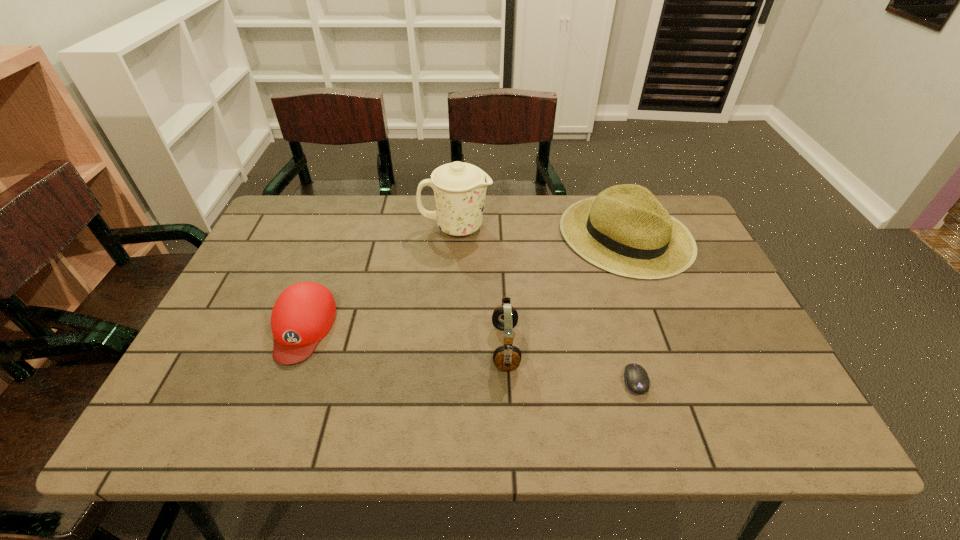
The image size is (960, 540). Identify the location of vacant area in the image that satisfies the following two spatial constraints: 1. on the front-facing side of the baseball cap; 2. on the right side of the shortest object. (283, 381).

This screenshot has width=960, height=540. I want to click on free location that satisfies the following two spatial constraints: 1. on the spout of the chinaware; 2. on the left side of the sunhat, so click(x=455, y=235).

Where is `vacant space that satisfies the following two spatial constraints: 1. on the spout of the chinaware; 2. on the front-facing side of the baseball cap`? The image size is (960, 540). vacant space that satisfies the following two spatial constraints: 1. on the spout of the chinaware; 2. on the front-facing side of the baseball cap is located at coordinates (449, 327).